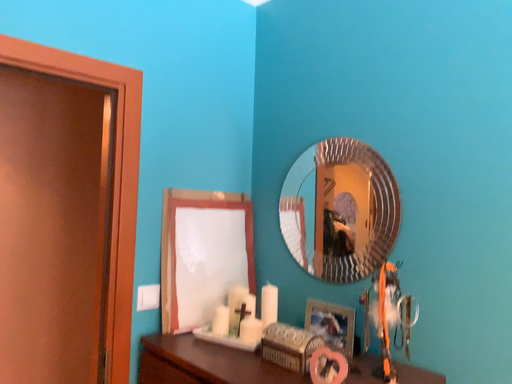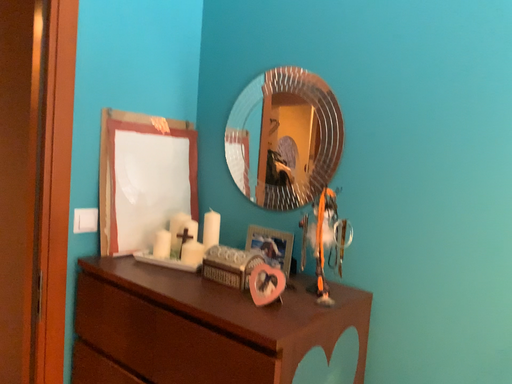
Question: Which way did the camera rotate in the video?

Choices:
 (A) rotated upward
 (B) rotated downward

Answer: (B)